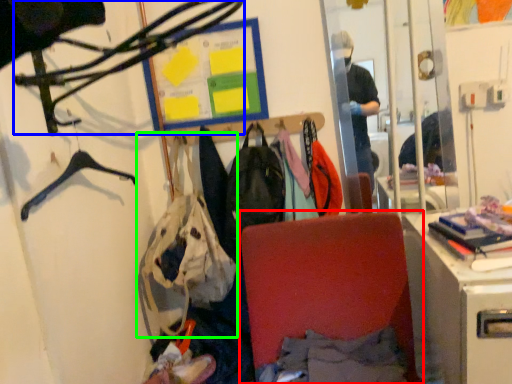
Question: Based on their relative distances, which object is farther from folding chair (highlighted by a red box)? Choose from hanger (highlighted by a blue box) and handbag (highlighted by a green box).

Choices:
 (A) hanger
 (B) handbag

Answer: (A)